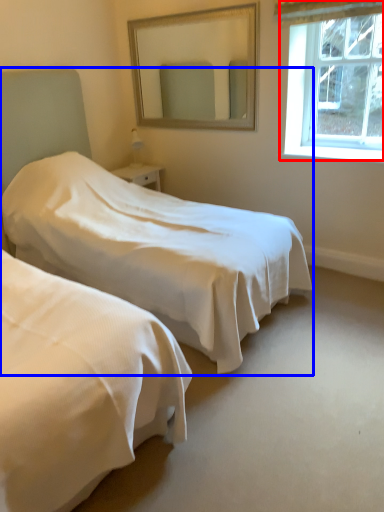
Question: Which point is closer to the camera, window (highlighted by a red box) or bed (highlighted by a blue box)?

Choices:
 (A) window
 (B) bed

Answer: (B)